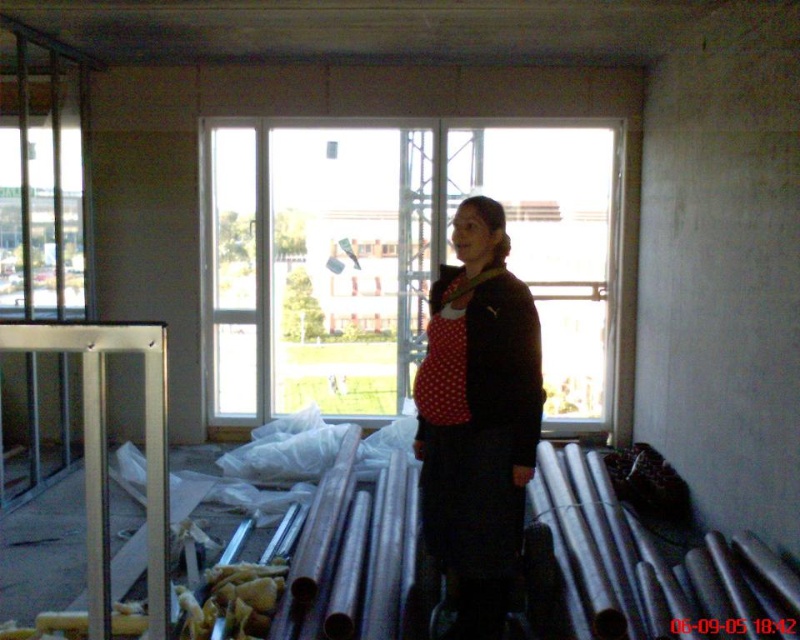
Between transparent glass window at center and polka dot fabric dress at center, which one is positioned higher?

transparent glass window at center is above.

Is transparent glass window at center taller than polka dot fabric dress at center?

Indeed, transparent glass window at center has a greater height compared to polka dot fabric dress at center.

Who is more forward, (374, 384) or (462, 200)?

Positioned in front is point (462, 200).

Find the location of a particular element. The image size is (800, 640). transparent glass window at center is located at coordinates (400, 260).